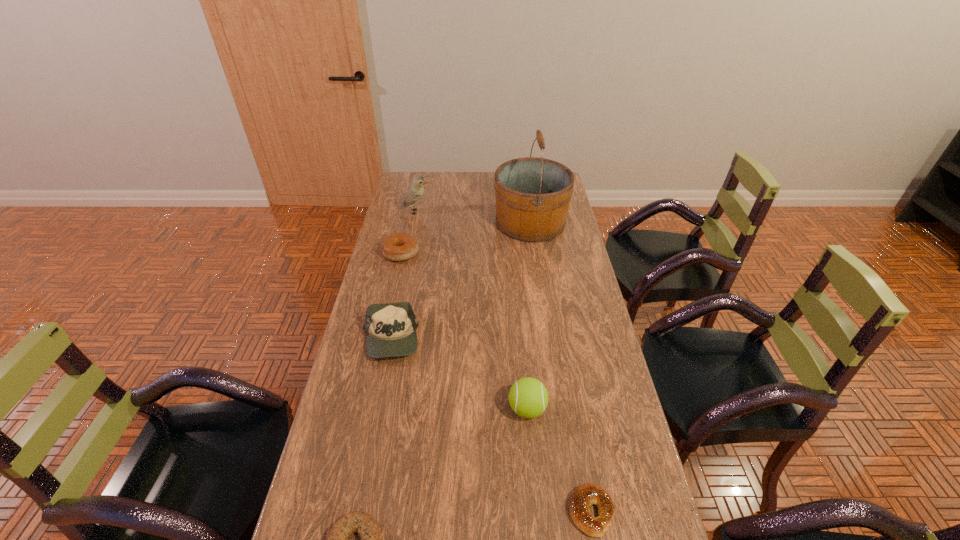
At what (x,y) coordinates should I click in order to perform the action: click on free space located 0.200m at the face of the second tallest object. Please return your answer as a coordinate pair (x, y). Looking at the image, I should click on (476, 212).

Identify the location of free space located 0.060m on the right of the third nearest object. This screenshot has width=960, height=540. (567, 409).

Identify the location of vacant area situated on the front-facing side of the fourth shortest object. (374, 417).

Where is `free region located on the back of the fifth tallest object`? The width and height of the screenshot is (960, 540). free region located on the back of the fifth tallest object is located at coordinates (412, 207).

Locate an element on the screen. blank space located on the left of the rightmost bagel is located at coordinates (436, 511).

You are a GUI agent. You are given a task and a screenshot of the screen. Output one action in this format:
    pyautogui.click(x=<x>, y=<y>)
    Task: Click on the bird positioned at the left edge
    The height and width of the screenshot is (540, 960).
    Given the screenshot: What is the action you would take?
    pyautogui.click(x=415, y=192)

You are a GUI agent. You are given a task and a screenshot of the screen. Output one action in this format:
    pyautogui.click(x=<x>, y=<y>)
    Task: Click on the baseball cap situated at the left edge
    
    Given the screenshot: What is the action you would take?
    pyautogui.click(x=391, y=328)

Where is `bagel present at the left edge`? bagel present at the left edge is located at coordinates (397, 247).

This screenshot has height=540, width=960. What are the coordinates of `bucket that is positioned at the right edge` in the screenshot? It's located at (532, 194).

At what (x,y) coordinates should I click in order to perform the action: click on bagel located at the right edge. Please return your answer as a coordinate pair (x, y). The width and height of the screenshot is (960, 540). Looking at the image, I should click on (588, 494).